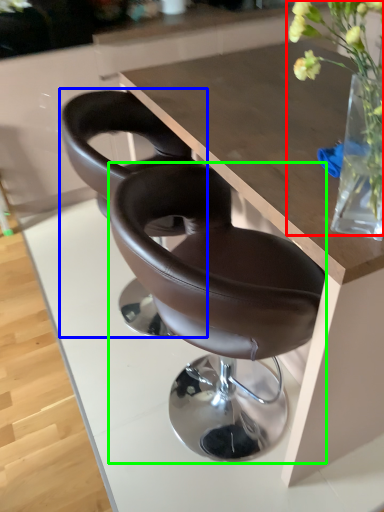
Question: Estimate the real-world distances between objects in this image. Which object is closer to floral arrangement (highlighted by a red box), chair (highlighted by a blue box) or chair (highlighted by a green box)?

Choices:
 (A) chair
 (B) chair

Answer: (B)